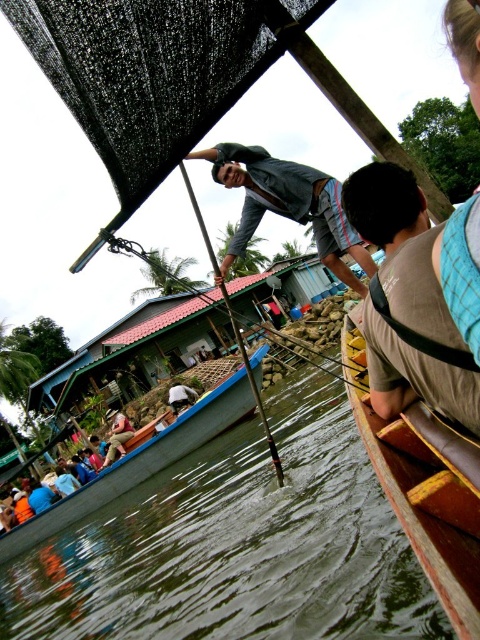
Can you confirm if brown cotton shirt at right is thinner than dark gray fabric shirt at center?

Indeed, brown cotton shirt at right has a lesser width compared to dark gray fabric shirt at center.

Between brown cotton shirt at right and dark gray fabric shirt at center, which one appears on the right side from the viewer's perspective?

brown cotton shirt at right

Between point (444, 317) and point (178, 401), which one is positioned behind?

Point (178, 401)

You are a GUI agent. You are given a task and a screenshot of the screen. Output one action in this format:
    pyautogui.click(x=<x>, y=<y>)
    Task: Click on the brown cotton shirt at right
    Image resolution: width=480 pixels, height=640 pixels.
    Given the screenshot: What is the action you would take?
    pyautogui.click(x=407, y=300)

Is dark gray shirt at upper center below wooden pole at center?

Actually, dark gray shirt at upper center is above wooden pole at center.

Consider the image. Is dark gray shirt at upper center to the right of wooden pole at center from the viewer's perspective?

Indeed, dark gray shirt at upper center is positioned on the right side of wooden pole at center.

Who is more forward, (x=219, y=177) or (x=227, y=296)?

Point (x=227, y=296) is in front.

Locate an element on the screen. dark gray shirt at upper center is located at coordinates (287, 205).

Which is in front, point (412, 380) or point (206, 424)?

Point (412, 380) is more forward.

The width and height of the screenshot is (480, 640). I want to click on brown cotton shirt at right, so click(407, 300).